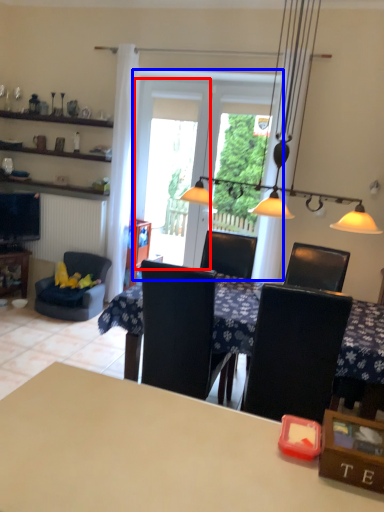
Question: Which object appears closest to the camera in this image, screen door (highlighted by a red box) or screen door (highlighted by a blue box)?

Choices:
 (A) screen door
 (B) screen door

Answer: (B)